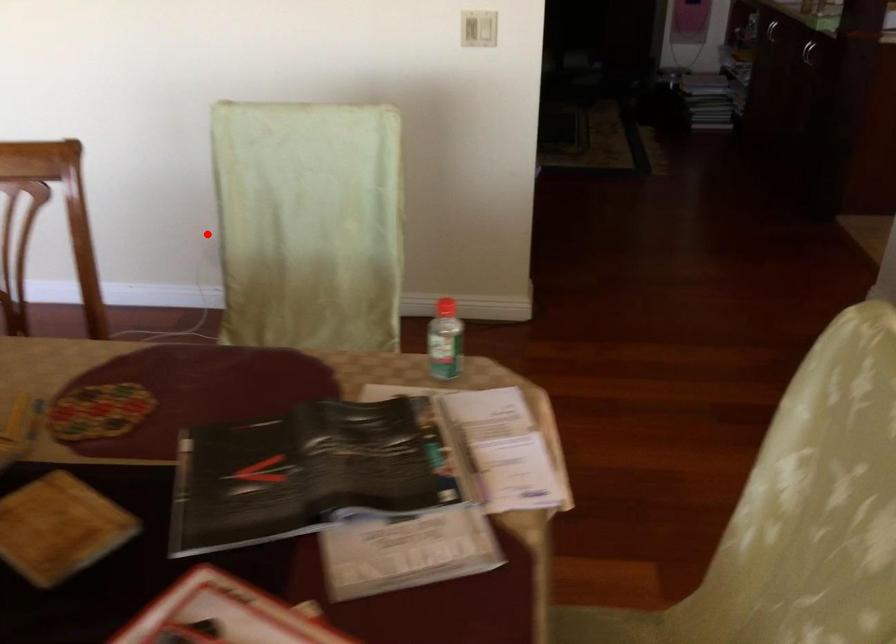
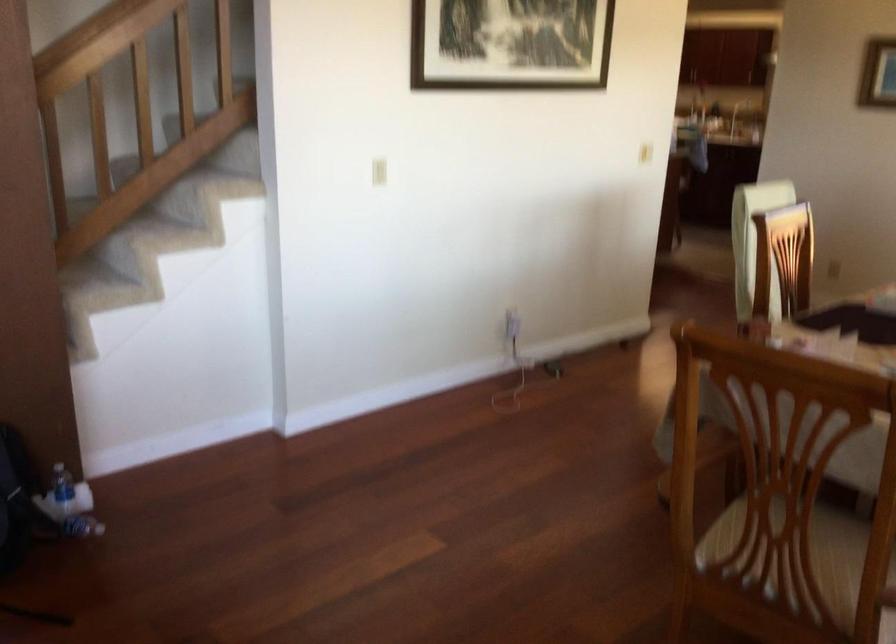
Locate, in the second image, the point that corresponds to the highlighted location in the first image.

(512, 324)